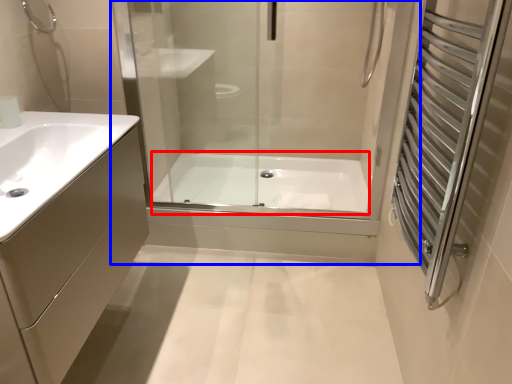
Question: Which point is closer to the camera, bath (highlighted by a red box) or shower door (highlighted by a blue box)?

Choices:
 (A) bath
 (B) shower door

Answer: (B)